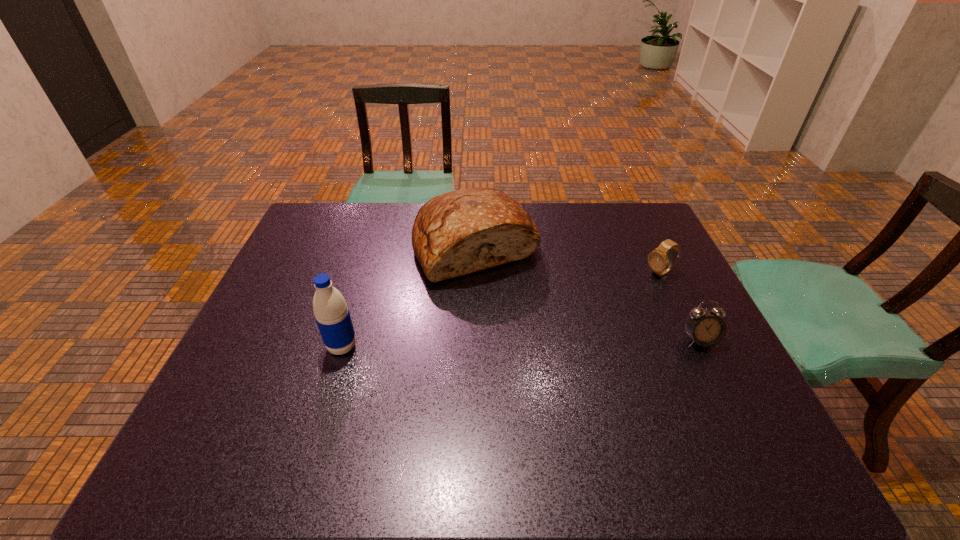
Locate an element on the screen. The width and height of the screenshot is (960, 540). free space on the desktop that is between the leftmost object and the alarm clock and is positioned at the sliced front of the third shortest object is located at coordinates (524, 343).

I want to click on free space on the desktop that is between the water bottle and the alarm clock and is positioned on the face of the watch, so click(520, 343).